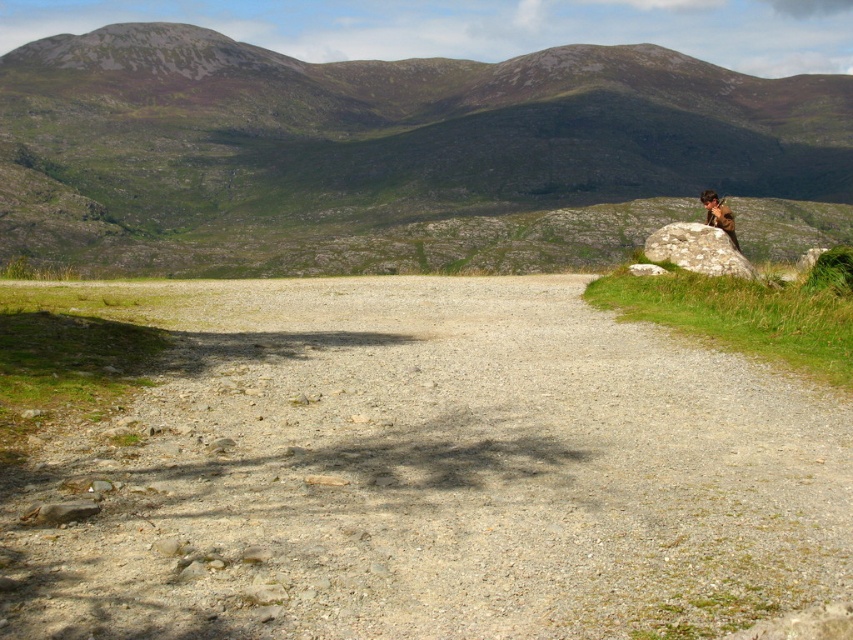
Which is behind, point (123, 458) or point (738, 250)?

Positioned behind is point (738, 250).

Who is more forward, (541, 557) or (706, 192)?

Point (541, 557) is more forward.

Is point (717, 448) positioned in front of point (728, 227)?

Yes, it is in front of point (728, 227).

Where is `gray gravel dirt track at center`? The height and width of the screenshot is (640, 853). gray gravel dirt track at center is located at coordinates (430, 472).

Is green grassy mountain at upper center smaller than speckled gray rock at right?

No, green grassy mountain at upper center is not smaller than speckled gray rock at right.

Which is behind, point (317, 180) or point (689, 252)?

The point (317, 180) is behind.

The width and height of the screenshot is (853, 640). I want to click on green grassy mountain at upper center, so click(x=396, y=156).

Consider the image. Between gray gravel dirt track at center and speckled gray rock at right, which one has less height?

With less height is speckled gray rock at right.

Does gray gravel dirt track at center have a greater height compared to speckled gray rock at right?

Correct, gray gravel dirt track at center is much taller as speckled gray rock at right.

Which is in front, point (270, 374) or point (695, 253)?

Point (270, 374)

Locate an element on the screen. gray gravel dirt track at center is located at coordinates (430, 472).